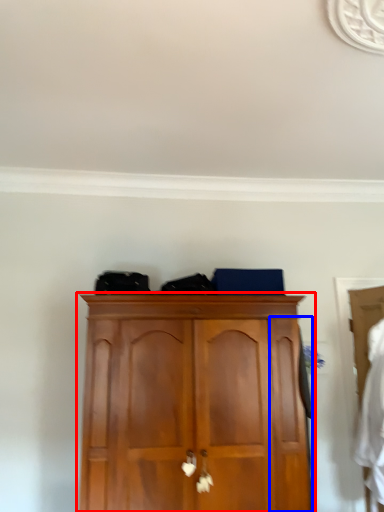
Question: Which object is closer to the camera taking this photo, cupboard (highlighted by a red box) or door (highlighted by a blue box)?

Choices:
 (A) cupboard
 (B) door

Answer: (A)